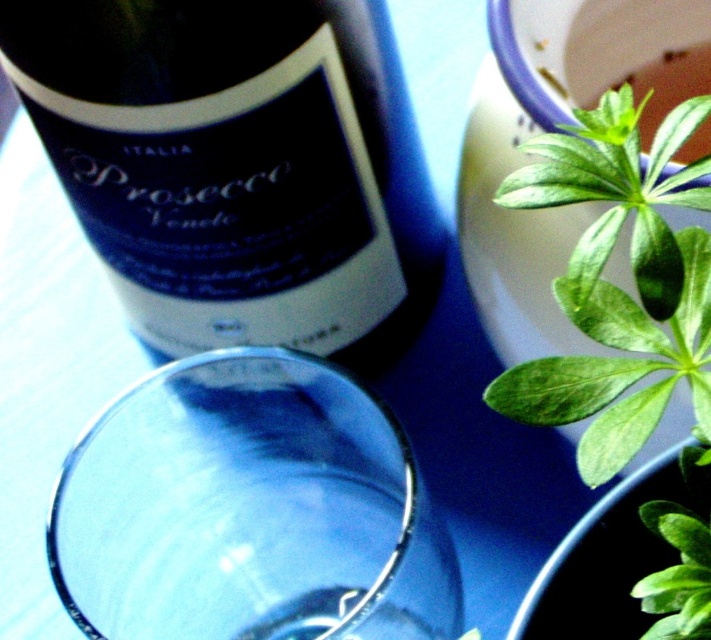
You are holding a small toy drone that can only fly up to 0.5 meters away from you. You want to fly it from point A to point B. Point A is at point [133,51] and point B is at point [653,336]. Based on the scene, can your drone reach point B from point A without going beyond its maximum range?

Point [133,51] is further to the viewer than point [653,336]. The distance between them is more than 0.5 meters, so the drone cannot reach point B from point A without exceeding its maximum range.